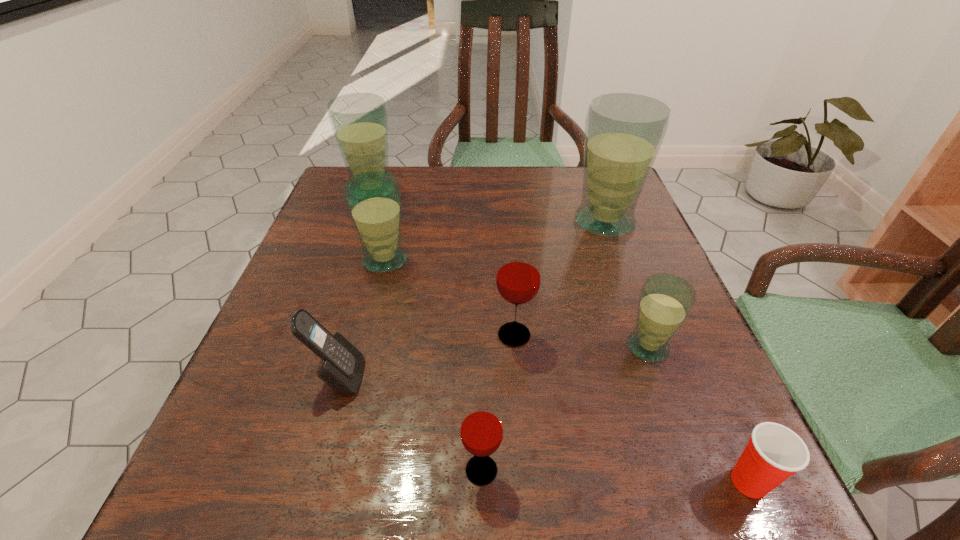
Where is `the nearer red glass`? This screenshot has width=960, height=540. the nearer red glass is located at coordinates (481, 430).

This screenshot has height=540, width=960. I want to click on Dixie cup, so click(774, 452).

Find the location of a particular element. Image resolution: width=960 pixels, height=540 pixels. red Dixie cup is located at coordinates (774, 452).

You are a GUI agent. You are given a task and a screenshot of the screen. Output one action in this format:
    pyautogui.click(x=<x>, y=<y>)
    Task: Click on the free space located 0.390m on the front of the tallest object
    Image resolution: width=960 pixels, height=540 pixels.
    Given the screenshot: What is the action you would take?
    pyautogui.click(x=668, y=397)

Locate an element on the screen. The image size is (960, 540). vacant space located on the right of the third smallest blue glass is located at coordinates (483, 191).

Locate an element on the screen. This screenshot has height=540, width=960. free point located 0.080m on the left of the sixth nearest object is located at coordinates (322, 260).

Where is `vacant space located 0.070m on the front of the farther red glass`? This screenshot has height=540, width=960. vacant space located 0.070m on the front of the farther red glass is located at coordinates (517, 387).

The height and width of the screenshot is (540, 960). I want to click on vacant space positioned 0.220m on the front-facing side of the cellular telephone, so click(x=500, y=377).

Identify the location of free region located on the right of the nearest blue glass. (701, 347).

You are a GUI agent. You are given a task and a screenshot of the screen. Output one action in this format:
    pyautogui.click(x=<x>, y=<y>)
    Task: Click on the vacant region located 0.310m on the right of the smaller red glass
    This screenshot has height=540, width=960.
    Given the screenshot: What is the action you would take?
    pyautogui.click(x=731, y=470)